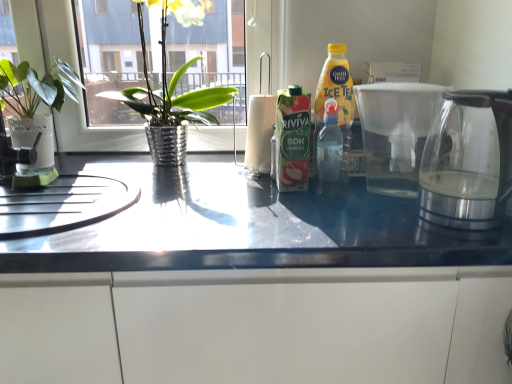
The image size is (512, 384). What are the coordinates of `vacant space in between transparent glass kettle at right, which is counted as the 2th coffeepot, starting from the back, and transparent glass coffeepot at right, placed as the 2th coffeepot when sorted from front to back` in the screenshot? It's located at (395, 214).